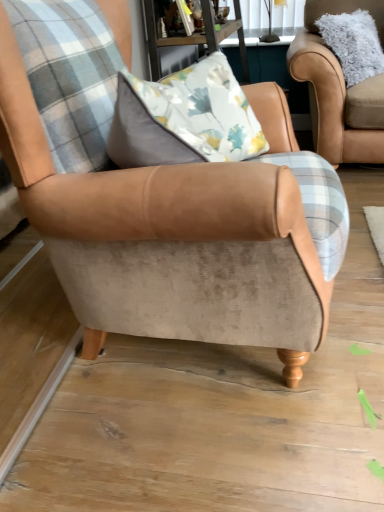
How much space does fuzzy beige armchair at upper right, arranged as the second chair when viewed from the front, occupy horizontally?

fuzzy beige armchair at upper right, arranged as the second chair when viewed from the front, is 16.62 inches wide.

What do you see at coordinates (194, 36) in the screenshot? I see `wooden table at upper center` at bounding box center [194, 36].

Identify the location of suede armchair at center, the second chair from the top. This screenshot has width=384, height=512. (148, 198).

Is suede armchair at center, the 1th chair from the bottom, in contact with wooden table at upper center?

No, suede armchair at center, the 1th chair from the bottom, is not with wooden table at upper center.

In the scene shown: How much distance is there between suede armchair at center, the second chair positioned from the right, and wooden table at upper center?

suede armchair at center, the second chair positioned from the right, is 1.19 meters away from wooden table at upper center.

Considering the sizes of objects suede armchair at center, the second chair positioned from the right, and wooden table at upper center in the image provided, who is thinner, suede armchair at center, the second chair positioned from the right, or wooden table at upper center?

wooden table at upper center is thinner.

Is suede armchair at center, the 1th chair from the bottom, oriented away from wooden table at upper center?

No, suede armchair at center, the 1th chair from the bottom, is not facing away from wooden table at upper center.

In terms of width, does wooden table at upper center look wider or thinner when compared to suede armchair at center, the second chair from the top?

Considering their sizes, wooden table at upper center looks slimmer than suede armchair at center, the second chair from the top.

Considering the relative sizes of wooden table at upper center and suede armchair at center, marked as the 1th chair in a left-to-right arrangement, in the image provided, is wooden table at upper center smaller than suede armchair at center, marked as the 1th chair in a left-to-right arrangement,?

Yes, wooden table at upper center is smaller than suede armchair at center, marked as the 1th chair in a left-to-right arrangement.

Can you confirm if wooden table at upper center is taller than suede armchair at center, the second chair positioned from the right?

No.

From a real-world perspective, which is physically below, fuzzy beige armchair at upper right, which is counted as the 1th chair, starting from the right, or suede armchair at center, marked as the 1th chair in a left-to-right arrangement?

suede armchair at center, marked as the 1th chair in a left-to-right arrangement, from a real-world perspective.

From the image's perspective, does fuzzy beige armchair at upper right, which is the first chair from back to front, appear lower than suede armchair at center, the second chair from the top?

Incorrect, from the image's perspective, fuzzy beige armchair at upper right, which is the first chair from back to front, is higher than suede armchair at center, the second chair from the top.

Considering the sizes of objects fuzzy beige armchair at upper right, which is counted as the 1th chair, starting from the right, and suede armchair at center, the second chair positioned from the right, in the image provided, who is wider, fuzzy beige armchair at upper right, which is counted as the 1th chair, starting from the right, or suede armchair at center, the second chair positioned from the right,?

suede armchair at center, the second chair positioned from the right, is wider.

Which object is positioned more to the left, fuzzy beige armchair at upper right, arranged as the second chair when viewed from the front, or suede armchair at center, the 1th chair from the bottom?

From the viewer's perspective, suede armchair at center, the 1th chair from the bottom, appears more on the left side.

From the picture: Which object is wider, fuzzy beige armchair at upper right, which is counted as the 1th chair, starting from the right, or wooden table at upper center?

wooden table at upper center is wider.

Which is behind, point (317, 71) or point (247, 63)?

The point (247, 63) is more distant.

Are fuzzy beige armchair at upper right, which is the first chair from back to front, and wooden table at upper center located far from each other?

No, fuzzy beige armchair at upper right, which is the first chair from back to front, is not far away from wooden table at upper center.

From a real-world perspective, relative to wooden table at upper center, is fuzzy beige armchair at upper right, which is counted as the 1th chair, starting from the right, vertically above or below?

From a real-world perspective, fuzzy beige armchair at upper right, which is counted as the 1th chair, starting from the right, is physically below wooden table at upper center.

Does point (148, 26) come in front of point (339, 98)?

Yes.

Is wooden table at upper center wider or thinner than fuzzy beige armchair at upper right, arranged as the second chair when viewed from the front?

Considering their sizes, wooden table at upper center looks broader than fuzzy beige armchair at upper right, arranged as the second chair when viewed from the front.

In the scene shown: Considering the sizes of objects wooden table at upper center and fuzzy beige armchair at upper right, the 2th chair in the left-to-right sequence, in the image provided, who is smaller, wooden table at upper center or fuzzy beige armchair at upper right, the 2th chair in the left-to-right sequence,?

Smaller between the two is fuzzy beige armchair at upper right, the 2th chair in the left-to-right sequence.

How distant is wooden table at upper center from fuzzy beige armchair at upper right, the 2th chair in the left-to-right sequence?

wooden table at upper center and fuzzy beige armchair at upper right, the 2th chair in the left-to-right sequence, are 26.22 inches apart.

Which of these two, suede armchair at center, the second chair positioned from the right, or fuzzy beige armchair at upper right, which is the first chair from back to front, is wider?

With larger width is suede armchair at center, the second chair positioned from the right.

Is suede armchair at center, positioned as the second chair in back-to-front order, directly adjacent to fuzzy beige armchair at upper right, which appears as the 1th chair when viewed from the top?

No, suede armchair at center, positioned as the second chair in back-to-front order, is not making contact with fuzzy beige armchair at upper right, which appears as the 1th chair when viewed from the top.

Which is more to the left, suede armchair at center, the second chair from the top, or fuzzy beige armchair at upper right, which ranks as the 2th chair in bottom-to-top order?

From the viewer's perspective, suede armchair at center, the second chair from the top, appears more on the left side.

Is suede armchair at center, positioned as the second chair in back-to-front order, inside or outside of fuzzy beige armchair at upper right, which is counted as the 1th chair, starting from the right?

suede armchair at center, positioned as the second chair in back-to-front order, is outside fuzzy beige armchair at upper right, which is counted as the 1th chair, starting from the right.

Locate an element on the screen. The image size is (384, 512). chair that appears below the wooden table at upper center (from the image's perspective) is located at coordinates (148, 198).

Where is `chair that is the 2nd object directly below the wooden table at upper center (from a real-world perspective)`? The height and width of the screenshot is (512, 384). chair that is the 2nd object directly below the wooden table at upper center (from a real-world perspective) is located at coordinates (148, 198).

When comparing their distances from fuzzy beige armchair at upper right, which ranks as the 2th chair in bottom-to-top order, does wooden table at upper center or suede armchair at center, marked as the 1th chair in a left-to-right arrangement, seem closer?

wooden table at upper center lies closer to fuzzy beige armchair at upper right, which ranks as the 2th chair in bottom-to-top order, than the other object.

From the image, which object appears to be nearer to wooden table at upper center, fuzzy beige armchair at upper right, which appears as the 1th chair when viewed from the top, or suede armchair at center, the first chair in the front-to-back sequence?

Among the two, fuzzy beige armchair at upper right, which appears as the 1th chair when viewed from the top, is located nearer to wooden table at upper center.

Which object lies further to the anchor point suede armchair at center, the first chair in the front-to-back sequence, fuzzy beige armchair at upper right, which is counted as the 1th chair, starting from the right, or wooden table at upper center?

fuzzy beige armchair at upper right, which is counted as the 1th chair, starting from the right, is further to suede armchair at center, the first chair in the front-to-back sequence.

Considering their positions, is wooden table at upper center positioned further to suede armchair at center, the second chair positioned from the right, than fuzzy beige armchair at upper right, which appears as the 1th chair when viewed from the top?

fuzzy beige armchair at upper right, which appears as the 1th chair when viewed from the top, is positioned further to the anchor suede armchair at center, the second chair positioned from the right.

Considering their positions, is suede armchair at center, positioned as the second chair in back-to-front order, positioned further to fuzzy beige armchair at upper right, which ranks as the 2th chair in bottom-to-top order, than wooden table at upper center?

Among the two, suede armchair at center, positioned as the second chair in back-to-front order, is located further to fuzzy beige armchair at upper right, which ranks as the 2th chair in bottom-to-top order.

From the image, which object appears to be farther from wooden table at upper center, suede armchair at center, the 1th chair from the bottom, or fuzzy beige armchair at upper right, which ranks as the 2th chair in bottom-to-top order?

suede armchair at center, the 1th chair from the bottom, is further to wooden table at upper center.

The height and width of the screenshot is (512, 384). In order to click on table positioned between suede armchair at center, the first chair in the front-to-back sequence, and fuzzy beige armchair at upper right, which is counted as the 1th chair, starting from the right, from near to far in this screenshot , I will do `click(194, 36)`.